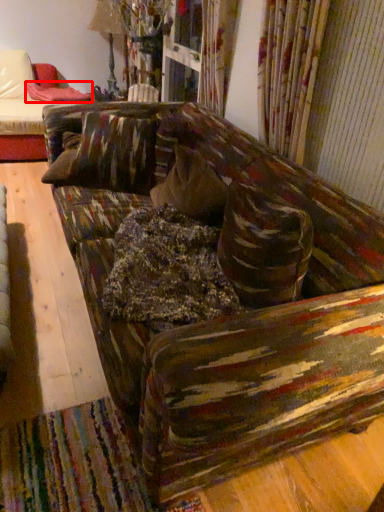
Question: From the image's perspective, where is blanket (annotated by the red box) located in relation to studio couch in the image?

Choices:
 (A) below
 (B) above

Answer: (B)